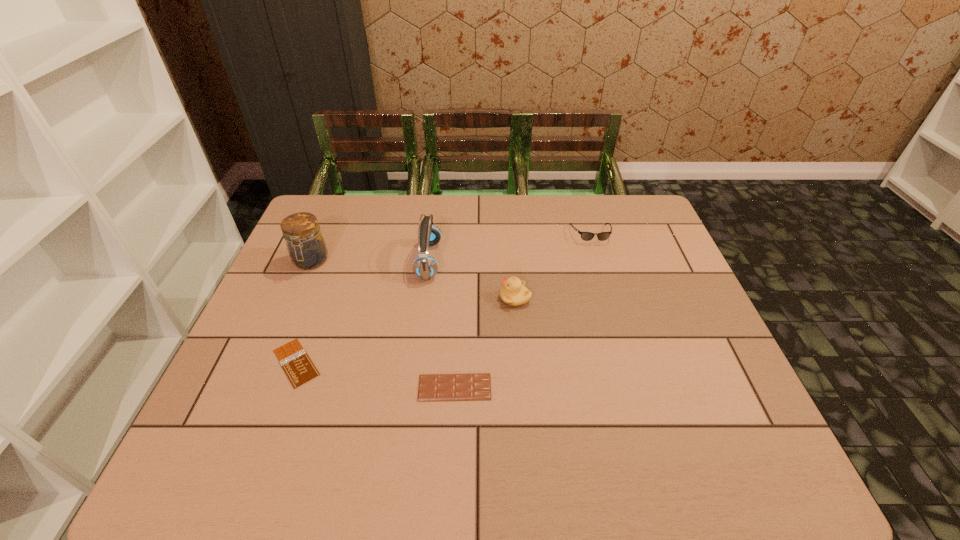
Locate an element on the screen. This screenshot has height=540, width=960. vacant space situated on the lid of the jar is located at coordinates (274, 348).

This screenshot has width=960, height=540. I want to click on blank area located 0.090m on the ear cups of the headset, so click(471, 260).

You are a GUI agent. You are given a task and a screenshot of the screen. Output one action in this format:
    pyautogui.click(x=<x>, y=<y>)
    Task: Click on the vacant space located 0.190m on the beak of the third nearest object
    Image resolution: width=960 pixels, height=540 pixels.
    Given the screenshot: What is the action you would take?
    pyautogui.click(x=429, y=298)

The height and width of the screenshot is (540, 960). Identify the location of vacant space located 0.070m on the beak of the third nearest object. (473, 298).

Identify the location of vacant space located 0.100m on the beak of the third nearest object. (463, 298).

Locate an element on the screen. The image size is (960, 540). free space located on the front-facing side of the rightmost object is located at coordinates coord(605,280).

The width and height of the screenshot is (960, 540). What are the coordinates of `vacant space located on the back of the right chocolate bar` in the screenshot? It's located at (457, 343).

Find the location of `vacant space located on the left of the shortest object`. vacant space located on the left of the shortest object is located at coordinates (233, 363).

You are a GUI agent. You are given a task and a screenshot of the screen. Output one action in this format:
    pyautogui.click(x=<x>, y=<y>)
    Task: Click on the object located at the far edge
    Image resolution: width=960 pixels, height=540 pixels.
    Given the screenshot: What is the action you would take?
    pyautogui.click(x=586, y=236)

The height and width of the screenshot is (540, 960). Find the location of `jar situated at the left edge`. jar situated at the left edge is located at coordinates (307, 249).